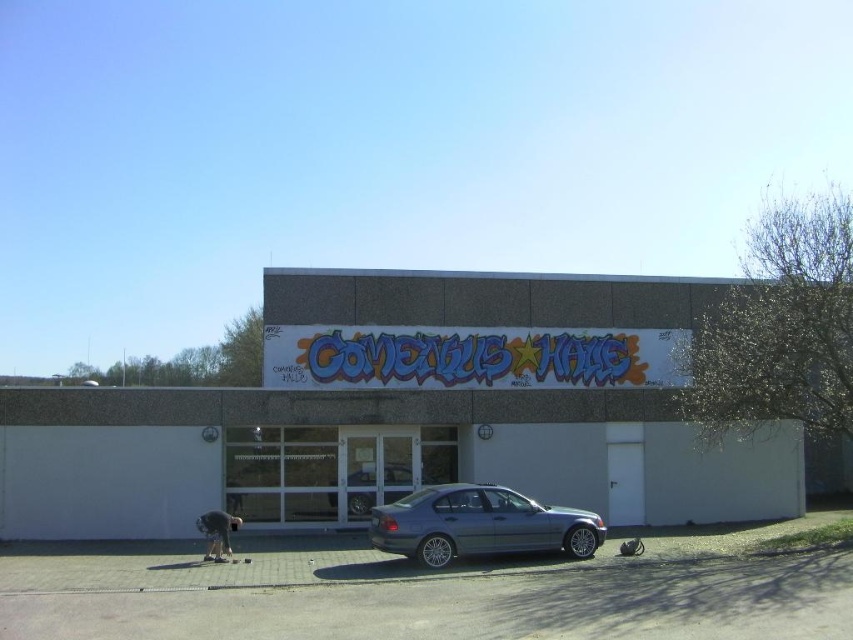
You are standing in front of the building and want to walk to the dark gray fabric person at lower left. Is the silver metallic sedan at center blocking your path?

The silver metallic sedan at center is further to the viewer than dark gray fabric person at lower left, so the sedan is closer to you. This means the silver metallic sedan at center is blocking your path to the dark gray fabric person at lower left.

You are standing in front of the building and want to take a photo of the graffiti sign on the concrete building at center while avoiding the parked satin silver sedan at center in the frame. Which direction should you move to ensure the sedan is out of the shot?

Move to the left of the satin silver sedan at center so that the concrete building at center comes into view to the right of the sedan, thus keeping the sedan out of the frame.

You are a delivery person standing at the entrance of the building. You need to load a package onto the satin silver sedan at center. The package is 5 meters long. Can you safely place the package between the sedan and the dark gray fabric person at lower left without hitting either?

The distance between the satin silver sedan at center and the dark gray fabric person at lower left is 4.78 meters. Since the package is 5 meters long, it would not fit between them safely. You need to find another location to place the package.